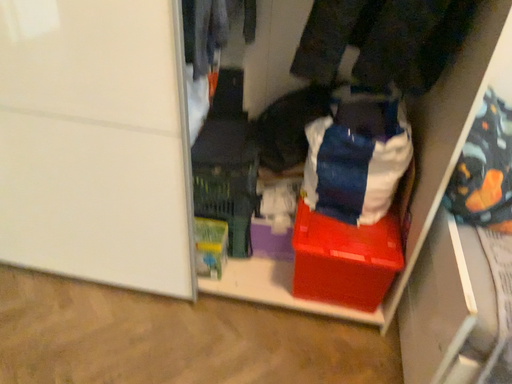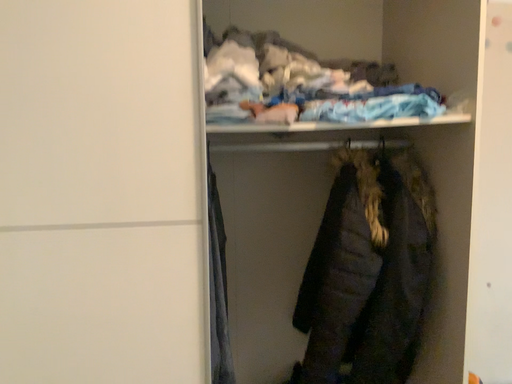
Question: Which way did the camera rotate in the video?

Choices:
 (A) rotated upward
 (B) rotated downward

Answer: (A)